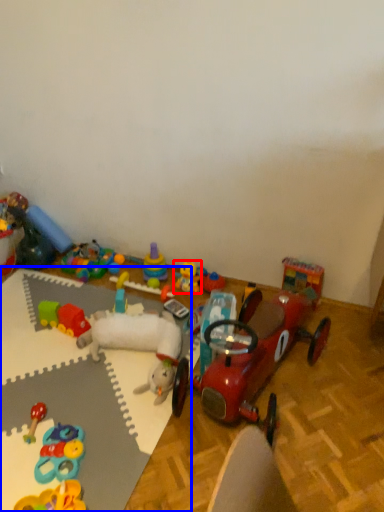
Question: Which object appears farthest to the camera in this image, toy (highlighted by a red box) or table (highlighted by a blue box)?

Choices:
 (A) toy
 (B) table

Answer: (A)